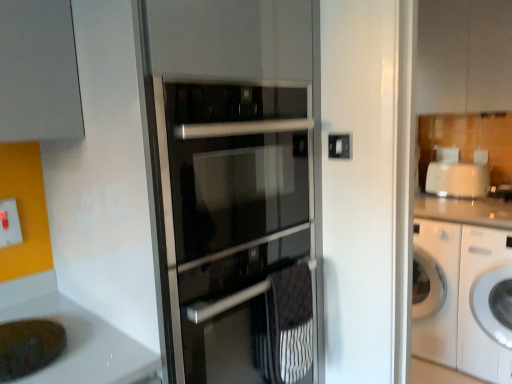
This screenshot has width=512, height=384. What are the coordinates of `free point above matte white sink at lower left (from a real-world perspective)` in the screenshot? It's located at (24, 336).